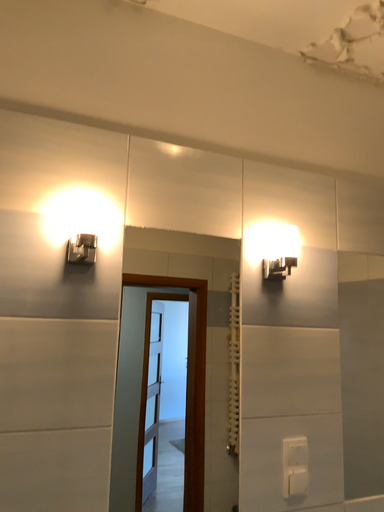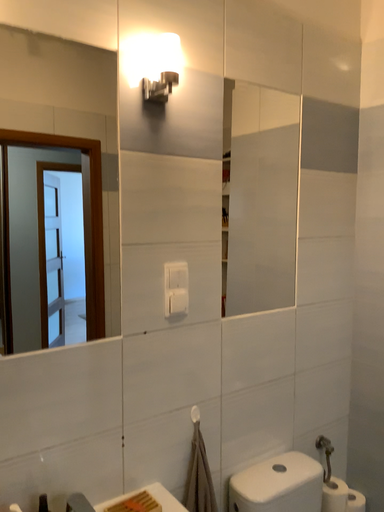
Question: Which way did the camera rotate in the video?

Choices:
 (A) rotated left
 (B) rotated right

Answer: (B)